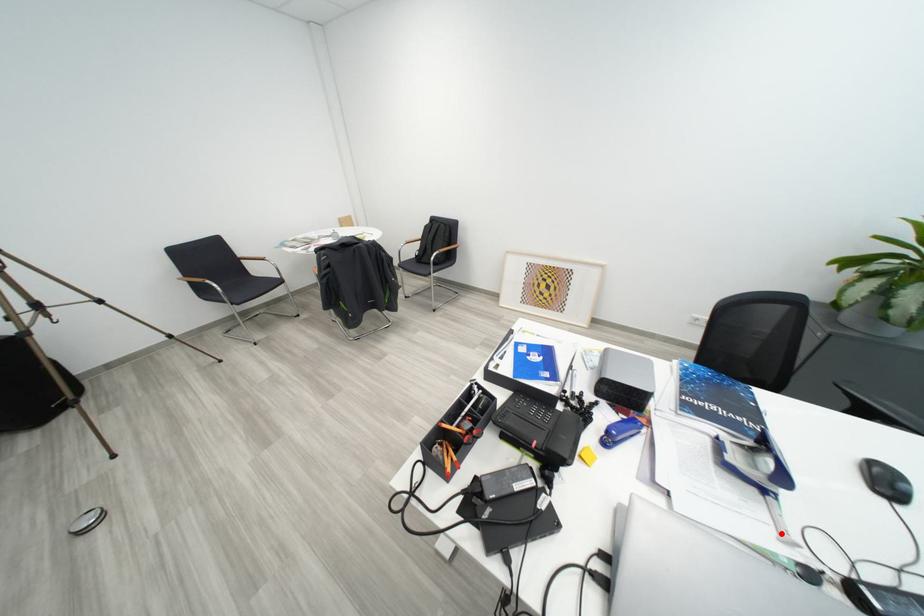
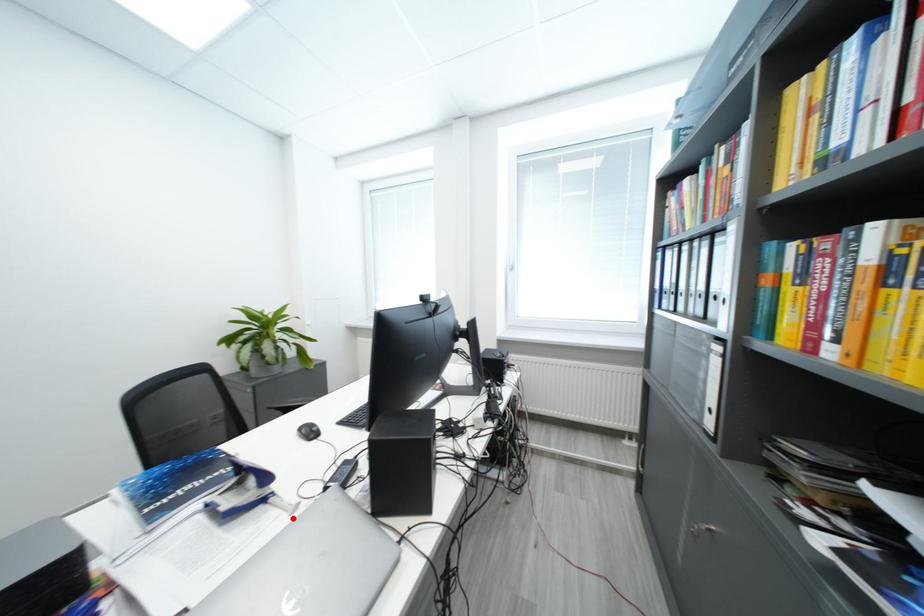
I am providing you with two images of the same scene from different viewpoints. A red point is marked on the first image and another point is marked on the second image. Do the highlighted points in image1 and image2 indicate the same real-world spot?

Yes